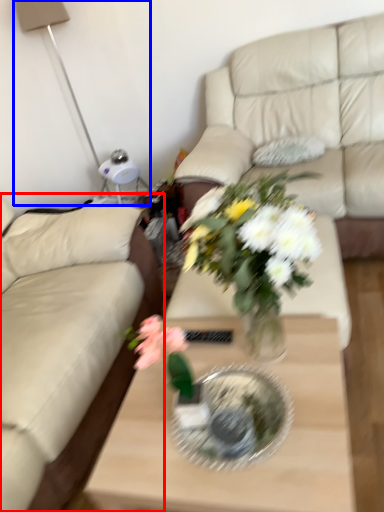
Question: Which of the following is the closest to the observer, studio couch (highlighted by a red box) or table lamp (highlighted by a blue box)?

Choices:
 (A) studio couch
 (B) table lamp

Answer: (A)